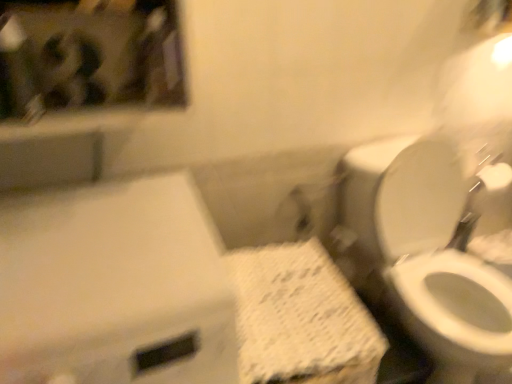
This screenshot has width=512, height=384. Find the location of `white glossy toilet at right`. white glossy toilet at right is located at coordinates (400, 204).

Measure the distance between point (341, 218) and camera.

1.60 meters.

The height and width of the screenshot is (384, 512). What do you see at coordinates (400, 204) in the screenshot?
I see `white glossy toilet at right` at bounding box center [400, 204].

Measure the distance between white glossy toilet at right and camera.

white glossy toilet at right and camera are 3.72 feet apart from each other.

This screenshot has height=384, width=512. In order to click on white glossy toilet at right in this screenshot , I will do `click(400, 204)`.